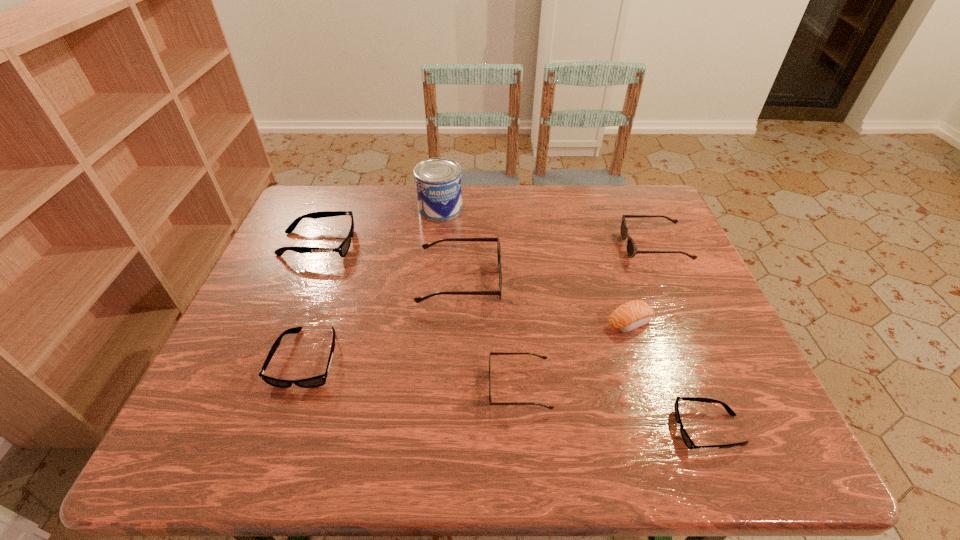
This screenshot has width=960, height=540. What are the coordinates of `can` in the screenshot? It's located at click(438, 183).

What are the coordinates of `the tallest object` in the screenshot? It's located at (438, 183).

Locate an element on the screen. This screenshot has height=540, width=960. the biggest brown sunglasses is located at coordinates (418, 299).

What are the coordinates of `the tallest sunglasses` in the screenshot? It's located at (418, 299).

At what (x,y) coordinates should I click in order to perform the action: click on the rightmost brown sunglasses. Please return your answer as a coordinate pair (x, y). The height and width of the screenshot is (540, 960). Looking at the image, I should click on (632, 250).

You are a GUI agent. You are given a task and a screenshot of the screen. Output one action in this format:
    pyautogui.click(x=<x>, y=<y>)
    Task: Click on the farthest black sunglasses
    
    Given the screenshot: What is the action you would take?
    pyautogui.click(x=344, y=247)

This screenshot has width=960, height=540. What are the coordinates of `sushi` in the screenshot? It's located at (631, 315).

In order to click on the second smallest black sunglasses in this screenshot , I will do `click(317, 381)`.

This screenshot has width=960, height=540. Find the location of `the smallest brown sunglasses`. the smallest brown sunglasses is located at coordinates (491, 353).

Find the location of a particular element. the nearest black sunglasses is located at coordinates (689, 443).